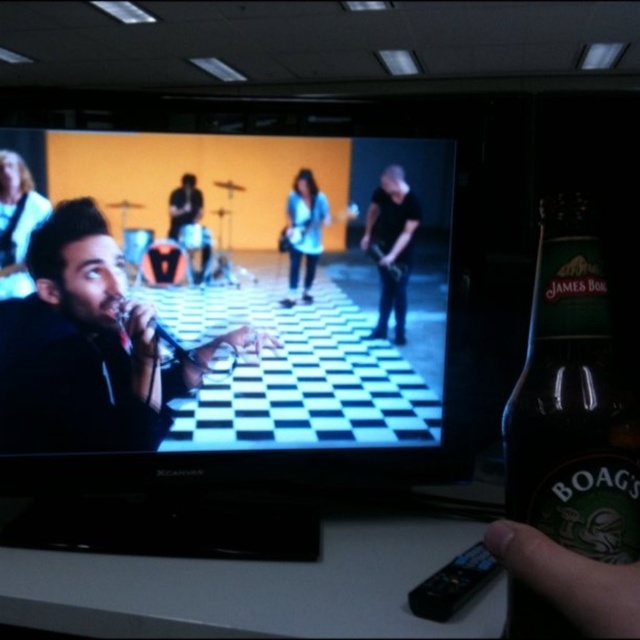
You are a photographer trying to capture a closeup of the band members on the TV screen. The TV screen has two points marked at coordinates point (596, 616) and point (307, 243). Which point should you focus on to get a clearer image of the band members?

Point (596, 616) is closer to the camera than point (307, 243), so focusing on point 0.961, 0.934 will provide a clearer image of the band members.

You are a bartender preparing a drink. You need to place the light blue denim jacket at center on the counter next to the dark skin hand at lower right holding a beer bottle. Can the jacket fit next to the hand without overlapping?

The dark skin hand at lower right is wider than the light blue denim jacket at center. Since the hand is wider, there might not be enough space for the jacket to fit next to it without overlapping. Please check the available space carefully.